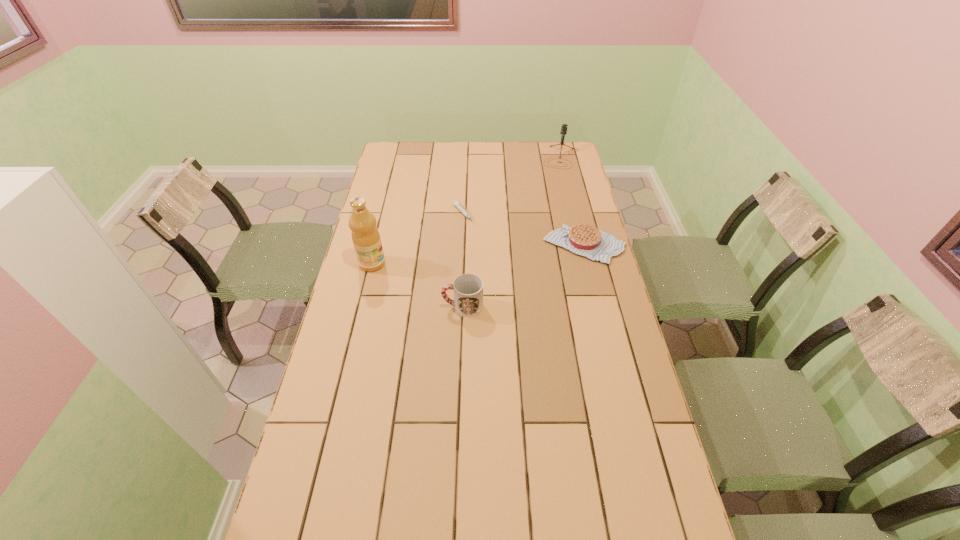
Locate an element on the screen. free space on the desktop that is between the nearest object and the fourth tallest object and is positioned on the label of the tallest object is located at coordinates (531, 272).

Locate an element on the screen. This screenshot has height=540, width=960. vacant spot on the desktop that is between the nearest object and the pie and is positioned on the stand of the microphone is located at coordinates coord(540,267).

Locate an element on the screen. The image size is (960, 540). vacant space on the desktop that is between the nearest object and the pie and is positioned at the needle end of the shortest object is located at coordinates (523, 276).